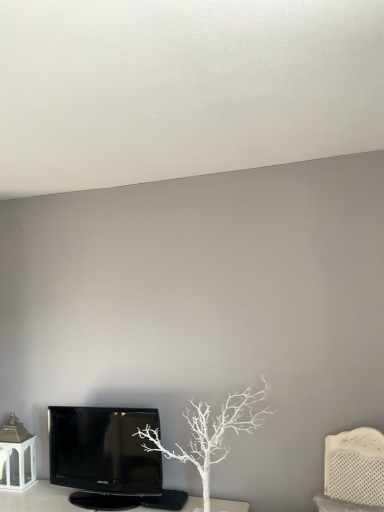
This screenshot has width=384, height=512. In order to click on white matte tree at center in this screenshot , I will do `click(211, 432)`.

From their relative heights in the image, would you say black glossy television at lower left is taller or shorter than white textured headboard at right?

Considering their sizes, black glossy television at lower left has more height than white textured headboard at right.

From the image's perspective, is black glossy television at lower left above or below white textured headboard at right?

From the image's perspective, black glossy television at lower left appears above white textured headboard at right.

Is black glossy television at lower left smaller than white textured headboard at right?

Incorrect, black glossy television at lower left is not smaller in size than white textured headboard at right.

Is black glossy television at lower left positioned beyond the bounds of white textured headboard at right?

That's correct, black glossy television at lower left is outside of white textured headboard at right.

Is black glossy television at lower left oriented away from white matte tree at center?

No, black glossy television at lower left is not facing away from white matte tree at center.

From the image's perspective, who appears lower, black glossy television at lower left or white matte tree at center?

black glossy television at lower left.

In terms of size, does black glossy television at lower left appear bigger or smaller than white matte tree at center?

black glossy television at lower left is smaller than white matte tree at center.

Between white matte tree at center and white textured headboard at right, which one has more height?

white matte tree at center is taller.

Is white textured headboard at right inside white matte tree at center?

No.

Is white matte tree at center further to camera compared to white textured headboard at right?

Yes, white matte tree at center is further from the camera.

Consider the image. Considering the positions of objects white textured headboard at right and black glossy television at lower left in the image provided, who is more to the left, white textured headboard at right or black glossy television at lower left?

black glossy television at lower left is more to the left.

Is white textured headboard at right positioned with its back to black glossy television at lower left?

white textured headboard at right is not turned away from black glossy television at lower left.

Where is `furniture that appears below the black glossy television at lower left (from the image's perspective)`? furniture that appears below the black glossy television at lower left (from the image's perspective) is located at coordinates (353, 472).

How much distance is there between white textured headboard at right and black glossy television at lower left?

white textured headboard at right and black glossy television at lower left are 1.07 meters apart from each other.

In terms of size, does white matte tree at center appear bigger or smaller than black glossy television at lower left?

Clearly, white matte tree at center is larger in size than black glossy television at lower left.

From the image's perspective, between white matte tree at center and black glossy television at lower left, which one is located above?

From the image's view, white matte tree at center is above.

From a real-world perspective, is white matte tree at center positioned above or below black glossy television at lower left?

white matte tree at center is situated higher than black glossy television at lower left in the real world.

Which is in front, point (370, 449) or point (199, 465)?

Positioned in front is point (370, 449).

In the scene shown: Is white matte tree at center at the back of white textured headboard at right?

No.

Based on the photo, between white textured headboard at right and white matte tree at center, which one has smaller size?

Smaller between the two is white textured headboard at right.

In the scene shown: Is white textured headboard at right far away from white matte tree at center?

Actually, white textured headboard at right and white matte tree at center are a little close together.

The height and width of the screenshot is (512, 384). I want to click on television above the white textured headboard at right (from the image's perspective), so tap(103, 455).

This screenshot has height=512, width=384. Find the location of `television that is on the left side of white matte tree at center`. television that is on the left side of white matte tree at center is located at coordinates (103, 455).

Considering their positions, is black glossy television at lower left positioned closer to white textured headboard at right than white matte tree at center?

Among the two, white matte tree at center is located nearer to white textured headboard at right.

Based on their spatial positions, is white textured headboard at right or white matte tree at center closer to black glossy television at lower left?

Based on the image, white matte tree at center appears to be nearer to black glossy television at lower left.

From the image, which object appears to be nearer to black glossy television at lower left, white matte tree at center or white textured headboard at right?

white matte tree at center lies closer to black glossy television at lower left than the other object.

Considering their positions, is white matte tree at center positioned further to white textured headboard at right than black glossy television at lower left?

black glossy television at lower left lies further to white textured headboard at right than the other object.

Considering their positions, is white textured headboard at right positioned further to white matte tree at center than black glossy television at lower left?

white textured headboard at right.

Which object lies nearer to the anchor point white matte tree at center, black glossy television at lower left or white textured headboard at right?

Among the two, black glossy television at lower left is located nearer to white matte tree at center.

At what (x,y) coordinates should I click in order to perform the action: click on tree between black glossy television at lower left and white textured headboard at right. Please return your answer as a coordinate pair (x, y). Looking at the image, I should click on (211, 432).